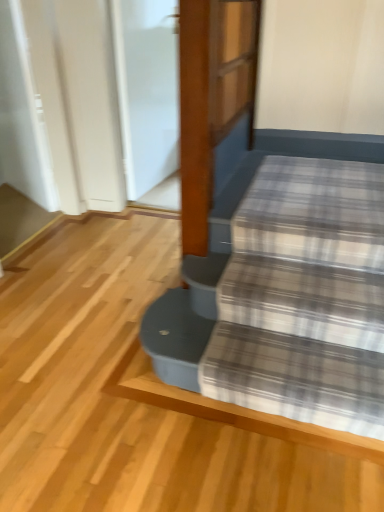
Find the location of a particular element. This screenshot has height=512, width=384. free space in front of plaid fabric at lower right is located at coordinates (254, 466).